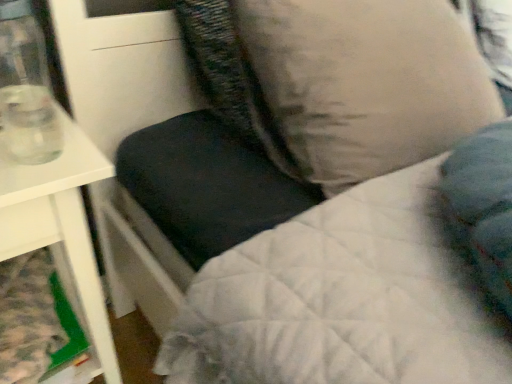
You are a GUI agent. You are given a task and a screenshot of the screen. Output one action in this format:
    pyautogui.click(x=<x>, y=<y>)
    Task: Click on the vacant area on top of white glossy table at left (from a real-world perspective)
    The width and height of the screenshot is (512, 384).
    Given the screenshot: What is the action you would take?
    pyautogui.click(x=27, y=133)